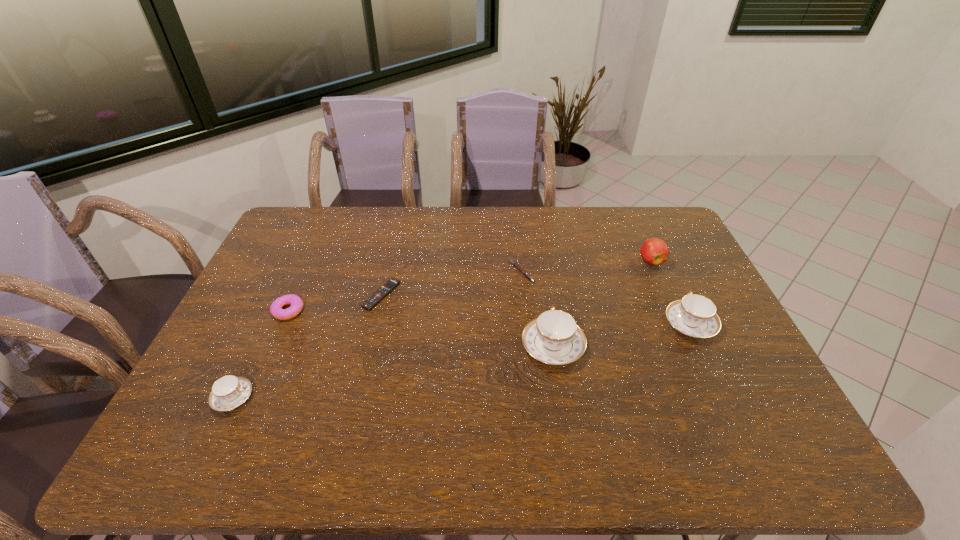
In the image, there is a desktop. Where is `vacant area at the left edge`? This screenshot has height=540, width=960. vacant area at the left edge is located at coordinates (216, 358).

Identify the location of vacant space at the far left corner of the desktop. This screenshot has width=960, height=540. point(319,240).

Image resolution: width=960 pixels, height=540 pixels. I want to click on vacant space in between the shortest teacup and the doughnut, so click(x=261, y=354).

You are a GUI agent. You are given a task and a screenshot of the screen. Output one action in this format:
    pyautogui.click(x=<x>, y=<y>)
    Task: Click on the empty location between the apple and the pen
    This screenshot has height=540, width=960.
    Given the screenshot: What is the action you would take?
    pyautogui.click(x=586, y=266)

The height and width of the screenshot is (540, 960). In order to click on free area in between the second teacup from right to left and the remote control in this screenshot , I will do `click(468, 321)`.

The width and height of the screenshot is (960, 540). I want to click on vacant area that lies between the second tallest teacup and the apple, so click(x=670, y=293).

Locate an element on the screen. free space between the fifth object from right to left and the apple is located at coordinates (516, 278).

This screenshot has height=540, width=960. What are the coordinates of `free spot between the second shortest teacup and the fourth shortest object` in the screenshot? It's located at (462, 361).

This screenshot has height=540, width=960. Find the location of `free space between the doughnut and the nearest object`. free space between the doughnut and the nearest object is located at coordinates (261, 354).

Identify the location of free space that is in between the fifth tallest object and the nearest object. (261, 354).